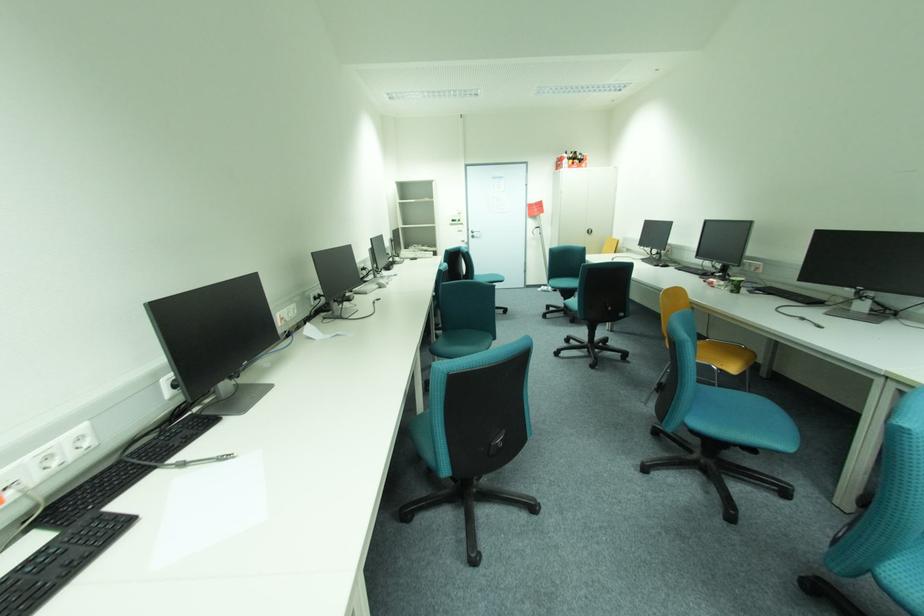
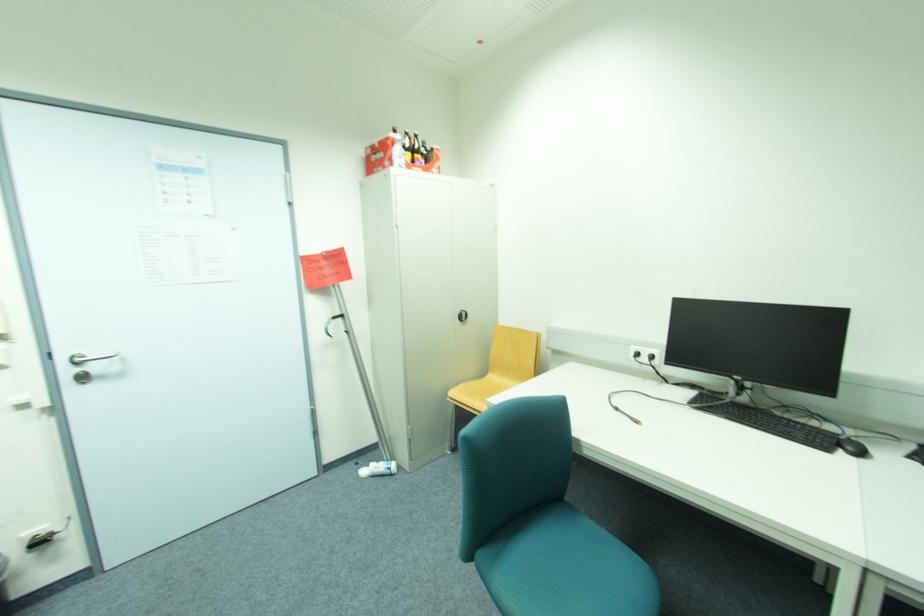
Where in the second image is the point corresponding to pixel 542 228 from the first image?

(339, 317)